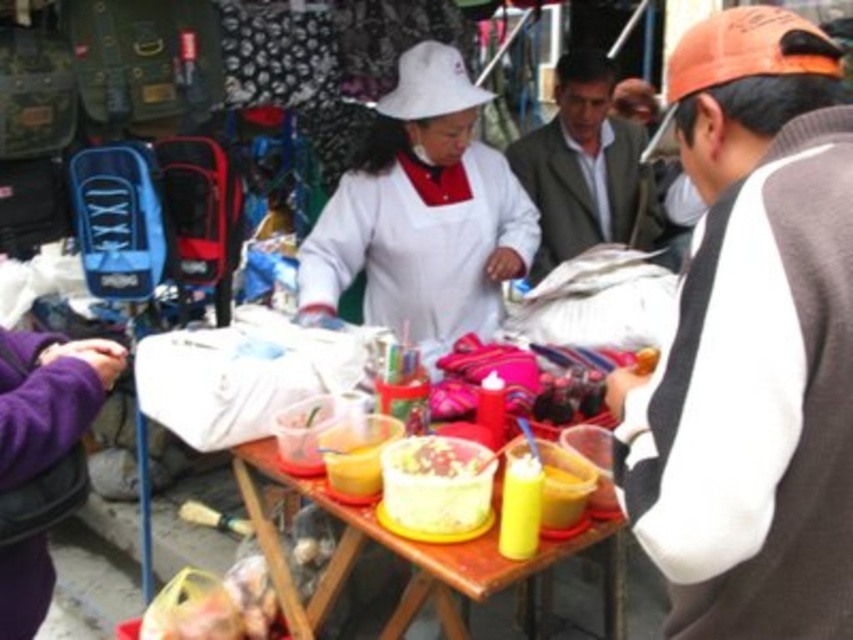
You are a customer at the food stall and want to know which of the two points, point (544, 260) or point (405, 452), is closer to you. Can you determine this?

Point (544, 260) is closer to you than point (405, 452) because it is further to the viewer.

You are a customer at the market stall and want to place your shopping bag on the wooden table at center. However, there is a shiny plastic bowl at center on the table. Can you place your bag there without moving the bowl?

The wooden table at center is positioned under the shiny plastic bowl at center, meaning the bowl is on top of the table. Therefore, you cannot place your shopping bag on the wooden table at center without moving the bowl.

You are a customer at the food stall and you want to take your order home. You see the yellow plastic bag at lower left and the shiny plastic bowl at center. Which container is closer to the left edge of the table?

The yellow plastic bag at lower left is positioned on the left side of the shiny plastic bowl at center, so it is closer to the left edge of the table.